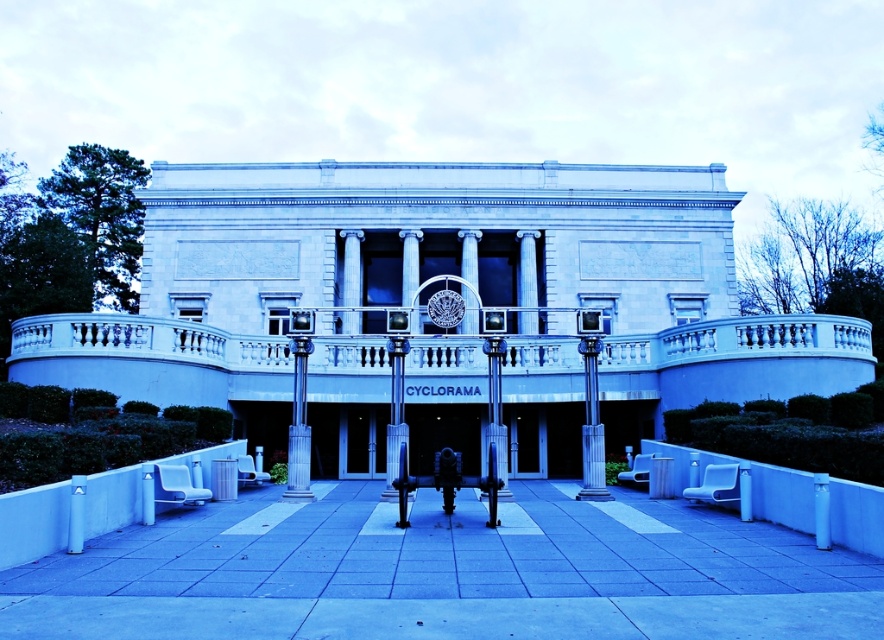
Question: Does slate gray stone column at center appear on the right side of polished stone column at center?

Choices:
 (A) yes
 (B) no

Answer: (B)

Question: Which point appears closest to the camera in this image?

Choices:
 (A) (305, 445)
 (B) (599, 424)
 (C) (387, 442)
 (D) (73, 538)

Answer: (D)

Question: Among these points, which one is nearest to the camera?

Choices:
 (A) (827, 481)
 (B) (72, 529)
 (C) (150, 557)
 (D) (400, 410)

Answer: (C)

Question: Does polished stone column at center have a larger size compared to smooth white pillar at lower left?

Choices:
 (A) yes
 (B) no

Answer: (A)

Question: Observing the image, what is the correct spatial positioning of smooth concrete pavement at center in reference to polished stone column at center?

Choices:
 (A) below
 (B) above

Answer: (A)

Question: Which is nearer to the smooth concrete pavement at center?

Choices:
 (A) polished metal pillar at center
 (B) smooth white pillar at lower left
 (C) polished stone column at center
 (D) slate gray stone column at center

Answer: (B)